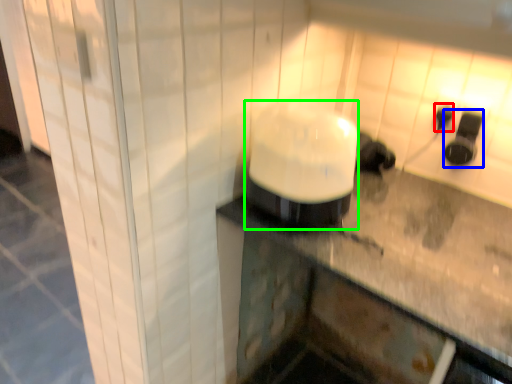
Question: Estimate the real-world distances between objects in this image. Which object is closer to electric outlet (highlighted by a red box), appliance (highlighted by a blue box) or appliance (highlighted by a green box)?

Choices:
 (A) appliance
 (B) appliance

Answer: (A)